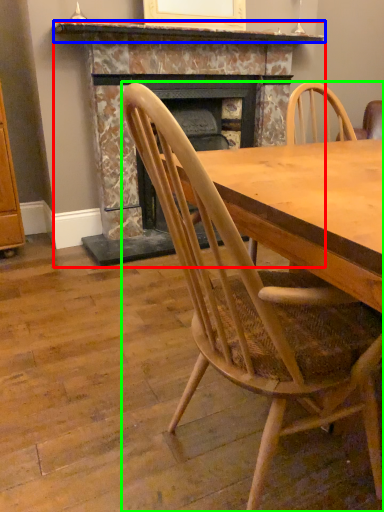
Question: Considering the real-world distances, which object is closest to fireplace (highlighted by a red box)? mantle (highlighted by a blue box) or chair (highlighted by a green box).

Choices:
 (A) mantle
 (B) chair

Answer: (A)